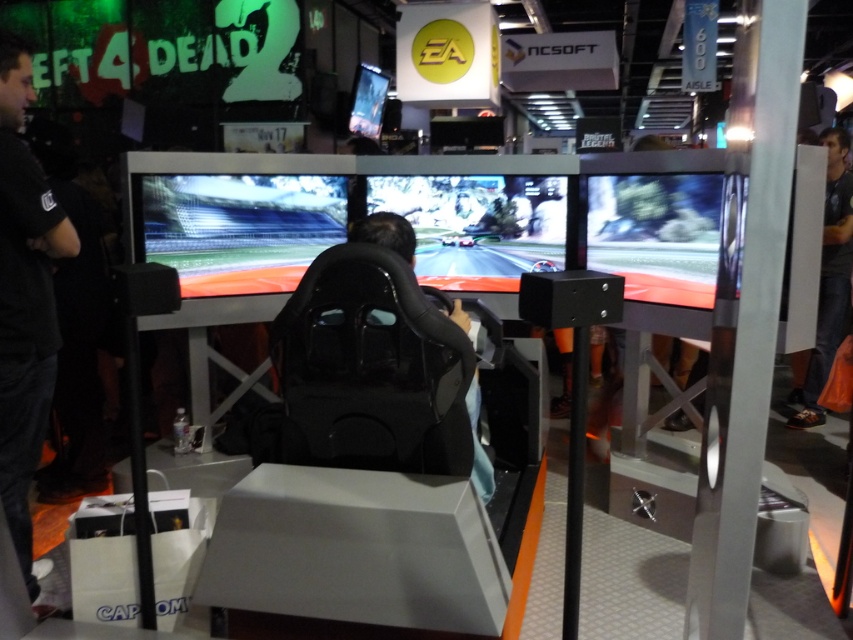
Is dark gray fabric at right taller than black leather chair at center?

Yes, dark gray fabric at right is taller than black leather chair at center.

What do you see at coordinates (828, 280) in the screenshot? I see `dark gray fabric at right` at bounding box center [828, 280].

Which is in front, point (837, 284) or point (376, 236)?

Point (376, 236) is more forward.

Where is `dark gray fabric at right`? The image size is (853, 640). dark gray fabric at right is located at coordinates (828, 280).

Can you confirm if black fabric shirt at left is positioned above dark gray fabric at right?

No.

Who is higher up, black fabric shirt at left or dark gray fabric at right?

dark gray fabric at right

You are a GUI agent. You are given a task and a screenshot of the screen. Output one action in this format:
    pyautogui.click(x=<x>, y=<y>)
    Task: Click on the black fabric shirt at left
    This screenshot has height=640, width=853.
    Given the screenshot: What is the action you would take?
    pyautogui.click(x=24, y=300)

Which of these two, black fabric shirt at left or black leather chair at center, stands shorter?

black leather chair at center

Does black fabric shirt at left appear on the left side of black leather chair at center?

Yes, black fabric shirt at left is to the left of black leather chair at center.

Locate an element on the screen. black fabric shirt at left is located at coordinates (24, 300).